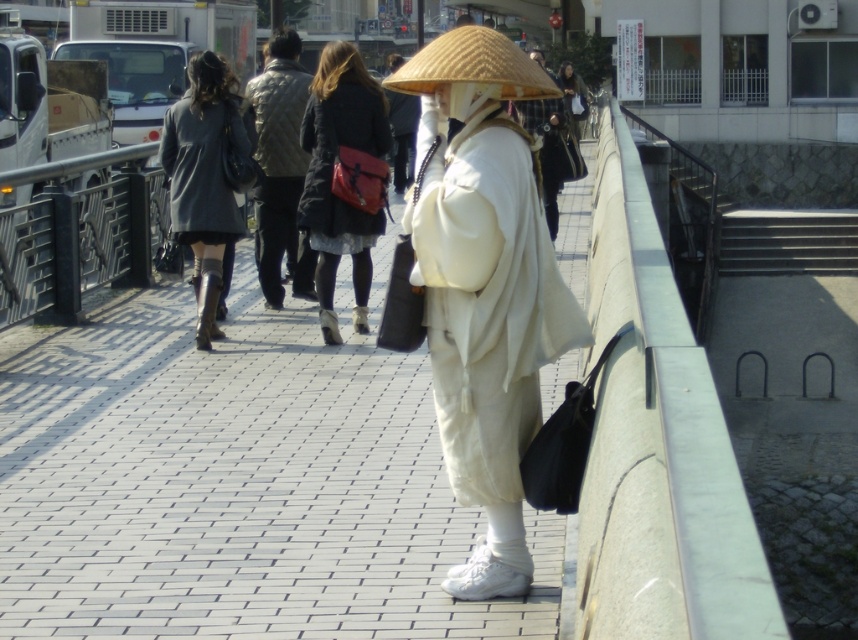
Describe the element at coordinates (331, 177) in the screenshot. I see `matte black coat at center` at that location.

Identify the location of matte black coat at center. (331, 177).

This screenshot has width=858, height=640. What do you see at coordinates (331, 177) in the screenshot?
I see `matte black coat at center` at bounding box center [331, 177].

Does matte black coat at center have a larger size compared to white matte robe at center?

No, matte black coat at center is not bigger than white matte robe at center.

Does point (361, 260) lie in front of point (539, 132)?

Yes, it is in front of point (539, 132).

Find the location of a particular element. matte black coat at center is located at coordinates (331, 177).

Consider the image. Does natural straw hat at center have a lesser width compared to white matte robe at center?

Yes, natural straw hat at center is thinner than white matte robe at center.

Can you confirm if natural straw hat at center is positioned to the right of white matte robe at center?

In fact, natural straw hat at center is to the left of white matte robe at center.

Does point (500, 42) lie behind point (559, 173)?

No.

Image resolution: width=858 pixels, height=640 pixels. Identify the location of natural straw hat at center. (473, 65).